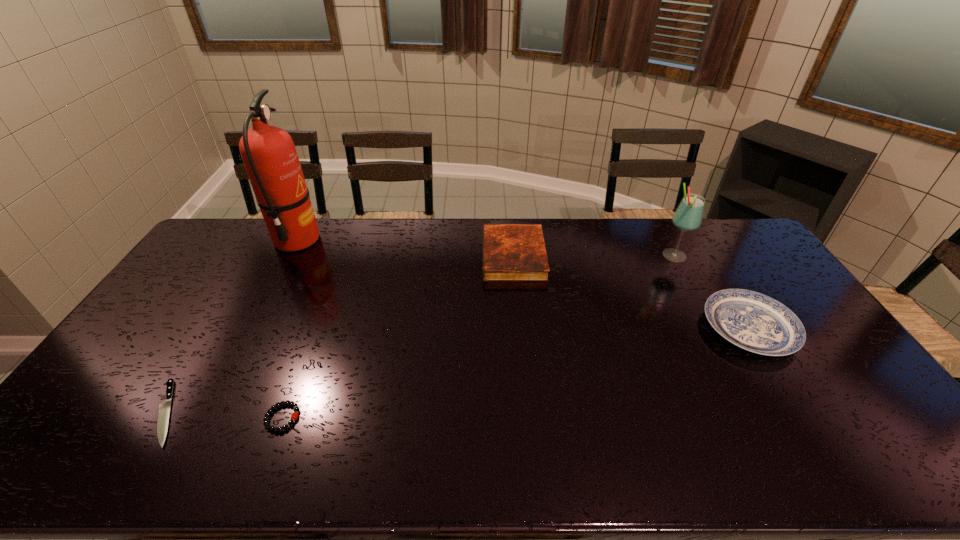
Locate an element on the screen. The height and width of the screenshot is (540, 960). empty location between the second shortest object and the fourth farthest object is located at coordinates (516, 373).

This screenshot has width=960, height=540. In order to click on vacant space that's between the steak knife and the third nearest object in this screenshot , I will do `click(458, 370)`.

Identify the location of empty location between the alcohol and the steak knife. This screenshot has height=540, width=960. (420, 335).

Choose which object is the nearest neighbor to the alcohol. Please provide its 2D coordinates. Your answer should be formatted as a tuple, i.e. [(x, y)], where the tuple contains the x and y coordinates of a point satisfying the conditions above.

[(755, 322)]

Point out which object is positioned as the third nearest to the second tallest object. Please provide its 2D coordinates. Your answer should be formatted as a tuple, i.e. [(x, y)], where the tuple contains the x and y coordinates of a point satisfying the conditions above.

[(294, 416)]

Find the location of a particular element. Image resolution: width=960 pixels, height=540 pixels. vacant space that satisfies the following two spatial constraints: 1. on the side of the fire extinguisher with the nozzle and handle; 2. on the back side of the fourth farthest object is located at coordinates (251, 328).

Identify the location of free location that satisfies the following two spatial constraints: 1. on the spine side of the third object from right to left; 2. on the front side of the steak knife. (528, 413).

Locate an element on the screen. blank area in the image that satisfies the following two spatial constraints: 1. on the side of the bracelet with the nozzle and handle; 2. on the right side of the fire extinguisher is located at coordinates (204, 417).

I want to click on free region that satisfies the following two spatial constraints: 1. on the back side of the fourth farthest object; 2. on the spine side of the third object from right to left, so click(705, 256).